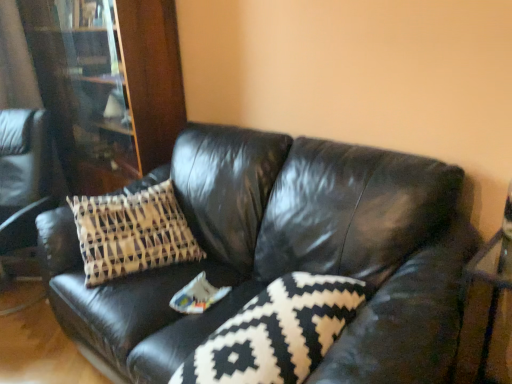
Question: From a real-world perspective, is wooden bookcase at left located higher than black and white patterned pillow at center?

Choices:
 (A) yes
 (B) no

Answer: (A)

Question: Can you confirm if wooden bookcase at left is positioned to the left of black and white patterned pillow at center?

Choices:
 (A) no
 (B) yes

Answer: (B)

Question: Does wooden bookcase at left have a larger size compared to black and white patterned pillow at center?

Choices:
 (A) no
 (B) yes

Answer: (B)

Question: Is wooden bookcase at left oriented towards black and white patterned pillow at center?

Choices:
 (A) no
 (B) yes

Answer: (A)

Question: Does wooden bookcase at left have a smaller size compared to black and white patterned pillow at center?

Choices:
 (A) no
 (B) yes

Answer: (A)

Question: From the image's perspective, would you say wooden bookcase at left is shown under black and white patterned pillow at center?

Choices:
 (A) no
 (B) yes

Answer: (A)

Question: Does black leather couch at center have a larger size compared to black and white patterned pillow at center?

Choices:
 (A) yes
 (B) no

Answer: (A)

Question: Considering the relative positions of black leather couch at center and black and white patterned pillow at center in the image provided, is black leather couch at center to the right of black and white patterned pillow at center from the viewer's perspective?

Choices:
 (A) no
 (B) yes

Answer: (A)

Question: Considering the relative sizes of black leather couch at center and black and white patterned pillow at center in the image provided, is black leather couch at center taller than black and white patterned pillow at center?

Choices:
 (A) yes
 (B) no

Answer: (A)

Question: Is black leather couch at center in front of black and white patterned pillow at center?

Choices:
 (A) yes
 (B) no

Answer: (A)

Question: From a real-world perspective, is black leather couch at center physically above black and white patterned pillow at center?

Choices:
 (A) yes
 (B) no

Answer: (B)

Question: From the image's perspective, does black leather couch at center appear higher than black and white patterned pillow at center?

Choices:
 (A) no
 (B) yes

Answer: (B)

Question: Does wooden bookcase at left have a greater height compared to black leather couch at center?

Choices:
 (A) no
 (B) yes

Answer: (B)